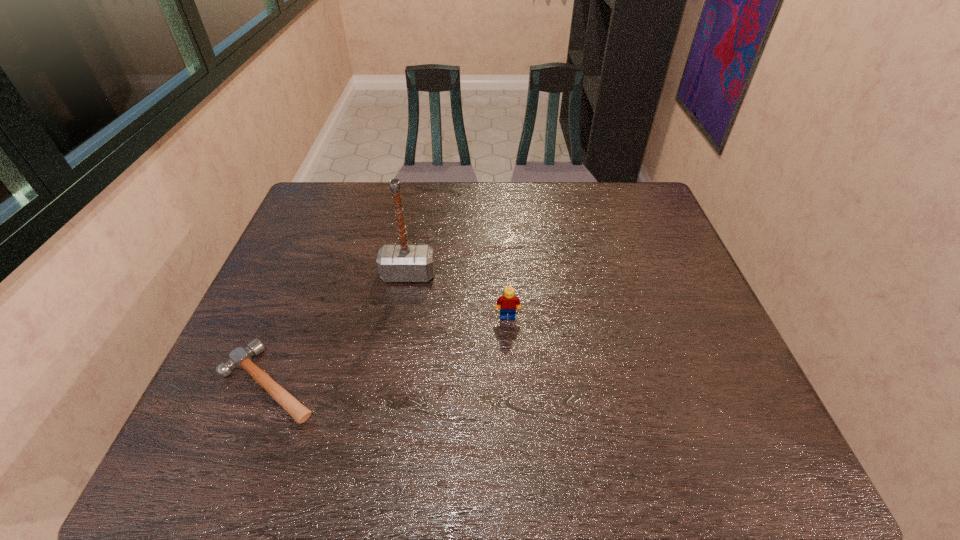
Locate an element on the screen. The height and width of the screenshot is (540, 960). vacant space at the far edge is located at coordinates (514, 198).

I want to click on vacant space at the near edge of the desktop, so click(326, 458).

You are a GUI agent. You are given a task and a screenshot of the screen. Output one action in this format:
    pyautogui.click(x=<x>, y=<y>)
    Task: Click on the vacant region at the left edge of the desktop
    
    Given the screenshot: What is the action you would take?
    pyautogui.click(x=304, y=342)

Where is `vacant space at the right edge of the desktop`? This screenshot has width=960, height=540. vacant space at the right edge of the desktop is located at coordinates (716, 328).

Find the location of a particular element. The width and height of the screenshot is (960, 540). vacant space at the far left corner is located at coordinates (305, 201).

Where is `vacant space at the far right corner of the desktop`? This screenshot has height=540, width=960. vacant space at the far right corner of the desktop is located at coordinates (610, 199).

Where is `free space between the second object from right to left and the shorter hammer`? free space between the second object from right to left and the shorter hammer is located at coordinates (339, 329).

Find the location of `vacant region between the Lego and the second object from right to left`. vacant region between the Lego and the second object from right to left is located at coordinates (458, 296).

Locate an element on the screen. The height and width of the screenshot is (540, 960). free spot between the second shortest object and the leftmost object is located at coordinates (389, 350).

You are a GUI agent. You are given a task and a screenshot of the screen. Output one action in this format:
    pyautogui.click(x=<x>, y=<y>)
    Task: Click on the free space between the right hammer and the second shortest object
    The height and width of the screenshot is (540, 960).
    Given the screenshot: What is the action you would take?
    pyautogui.click(x=458, y=296)